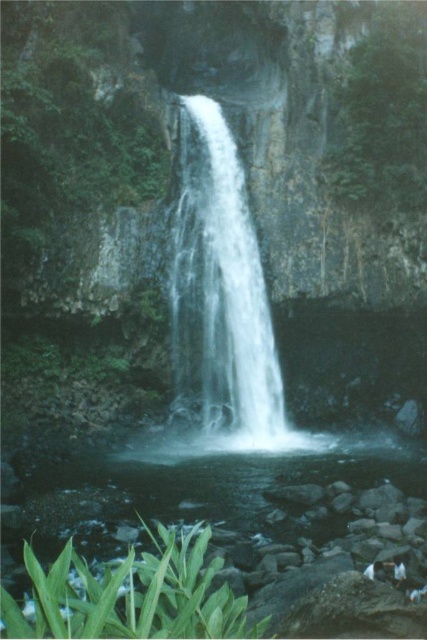
Is point (207, 316) positioned behind point (64, 576)?

Yes, point (207, 316) is farther from viewer.

Consider the image. Who is positioned more to the left, white smooth waterfall at center or green leafy plant at lower left?

Positioned to the left is green leafy plant at lower left.

This screenshot has width=427, height=640. What do you see at coordinates (222, 278) in the screenshot?
I see `white smooth waterfall at center` at bounding box center [222, 278].

Find the location of a particular element. The width and height of the screenshot is (427, 640). white smooth waterfall at center is located at coordinates (222, 278).

This screenshot has height=640, width=427. Describe the element at coordinates (131, 595) in the screenshot. I see `green leafy plant at lower left` at that location.

Locate an element on the screen. green leafy plant at lower left is located at coordinates (131, 595).

The width and height of the screenshot is (427, 640). Find the location of `green leafy plant at lower left`. green leafy plant at lower left is located at coordinates (131, 595).

Where is `green leafy plant at lower left`? The width and height of the screenshot is (427, 640). green leafy plant at lower left is located at coordinates (131, 595).

Who is shorter, white smooth waterfall at center or green leafy plant at upper right?

Standing shorter between the two is white smooth waterfall at center.

Can you confirm if white smooth waterfall at center is taller than green leafy plant at upper right?

Incorrect, white smooth waterfall at center's height is not larger of green leafy plant at upper right's.

Which is behind, point (195, 112) or point (345, 61)?

The point (195, 112) is behind.

Identify the location of white smooth waterfall at center. (222, 278).